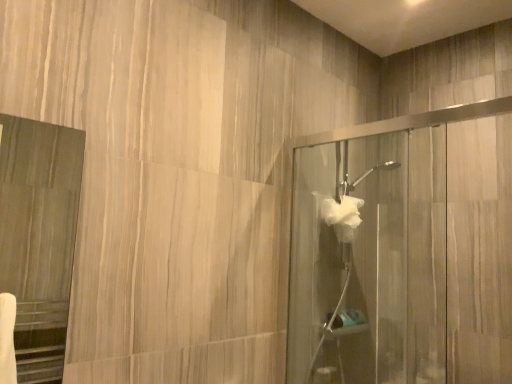
Question: Considering the relative sizes of clear glass shower door at right, acting as the second screen door starting from the front, and matte wood mirror at left, the first screen door in the left-to-right sequence, in the image provided, is clear glass shower door at right, acting as the second screen door starting from the front, wider than matte wood mirror at left, the first screen door in the left-to-right sequence,?

Choices:
 (A) yes
 (B) no

Answer: (A)

Question: From a real-world perspective, is clear glass shower door at right, which is the 1th screen door in back-to-front order, positioned under matte wood mirror at left, which is the 1th screen door in front-to-back order, based on gravity?

Choices:
 (A) no
 (B) yes

Answer: (B)

Question: Can you confirm if clear glass shower door at right, the 1th screen door in the right-to-left sequence, is smaller than matte wood mirror at left, which is the 1th screen door in front-to-back order?

Choices:
 (A) no
 (B) yes

Answer: (A)

Question: Is the depth of clear glass shower door at right, acting as the second screen door starting from the front, less than that of matte wood mirror at left, placed as the second screen door when sorted from back to front?

Choices:
 (A) yes
 (B) no

Answer: (B)

Question: From the image's perspective, is clear glass shower door at right, acting as the second screen door starting from the front, located beneath matte wood mirror at left, placed as the second screen door when sorted from back to front?

Choices:
 (A) yes
 (B) no

Answer: (A)

Question: Is clear glass shower door at right, the 2th screen door positioned from the left, at the left side of matte wood mirror at left, placed as the second screen door when sorted from back to front?

Choices:
 (A) no
 (B) yes

Answer: (A)

Question: Can you confirm if matte wood mirror at left, placed as the second screen door when sorted from back to front, is wider than clear glass shower door at right, the 1th screen door in the right-to-left sequence?

Choices:
 (A) yes
 (B) no

Answer: (B)

Question: Does matte wood mirror at left, placed as the second screen door when sorted from back to front, have a lesser width compared to clear glass shower door at right, acting as the second screen door starting from the front?

Choices:
 (A) yes
 (B) no

Answer: (A)

Question: Are matte wood mirror at left, the first screen door in the left-to-right sequence, and clear glass shower door at right, the 2th screen door positioned from the left, far apart?

Choices:
 (A) yes
 (B) no

Answer: (A)

Question: From the image's perspective, is matte wood mirror at left, which is the 2th screen door from right to left, on clear glass shower door at right, the 2th screen door positioned from the left?

Choices:
 (A) no
 (B) yes

Answer: (B)

Question: From a real-world perspective, does matte wood mirror at left, which is the 1th screen door in front-to-back order, stand above clear glass shower door at right, the 2th screen door positioned from the left?

Choices:
 (A) no
 (B) yes

Answer: (B)

Question: Is matte wood mirror at left, which is the 1th screen door in front-to-back order, at the left side of clear glass shower door at right, acting as the second screen door starting from the front?

Choices:
 (A) no
 (B) yes

Answer: (B)

Question: Is white fluffy hand towel at center-right not near clear glass shower door at right, the 2th screen door positioned from the left?

Choices:
 (A) no
 (B) yes

Answer: (A)